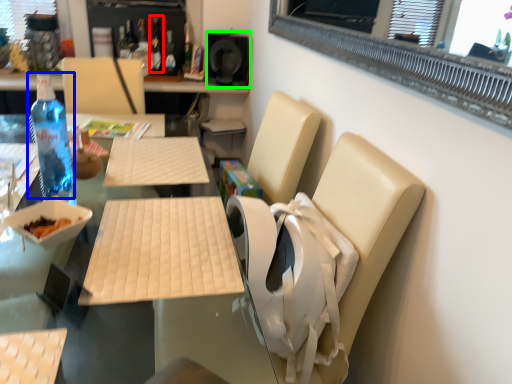
Question: Based on their relative distances, which object is farther from bottle (highlighted by a red box)? Choose from bottle (highlighted by a blue box) and speaker (highlighted by a green box).

Choices:
 (A) bottle
 (B) speaker

Answer: (A)